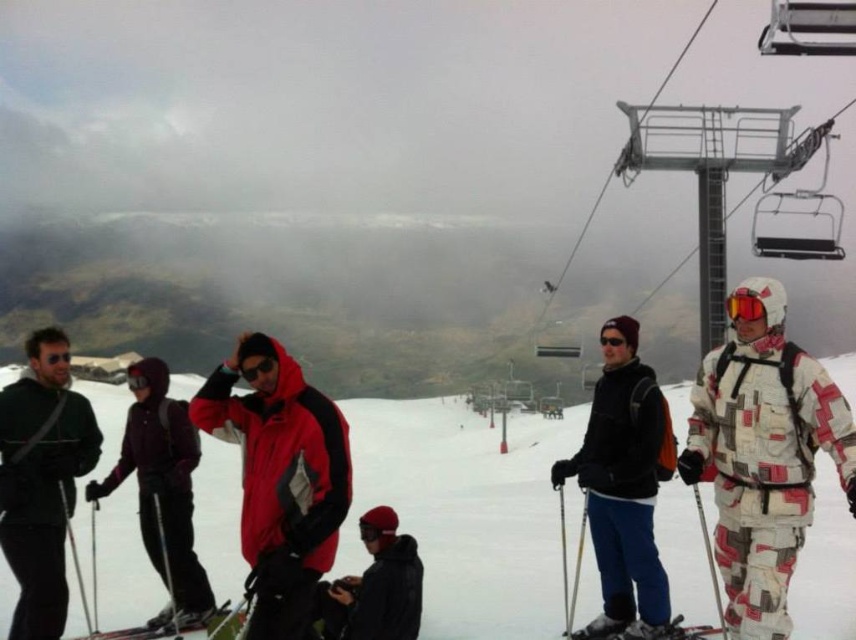
Between metallic gray chair at upper right and matte black ski at lower left, which one has more height?

metallic gray chair at upper right

Does metallic gray chair at upper right have a lesser width compared to matte black ski at lower left?

Incorrect, metallic gray chair at upper right's width is not less than matte black ski at lower left's.

Is point (831, 241) less distant than point (173, 627)?

No, it is not.

What are the coordinates of `metallic gray chair at upper right` in the screenshot? It's located at (797, 225).

Is matte purple ski suit at left bigger than black matte jacket at lower center?

Indeed, matte purple ski suit at left has a larger size compared to black matte jacket at lower center.

Does matte purple ski suit at left come in front of black matte jacket at lower center?

No, matte purple ski suit at left is further to the viewer.

Describe the element at coordinates (162, 490) in the screenshot. I see `matte purple ski suit at left` at that location.

Find the location of a particular element. The height and width of the screenshot is (640, 856). matte purple ski suit at left is located at coordinates (162, 490).

Between metallic gray chair at upper right and metallic gray lift at upper right, which one appears on the left side from the viewer's perspective?

metallic gray lift at upper right

The image size is (856, 640). Describe the element at coordinates (797, 225) in the screenshot. I see `metallic gray chair at upper right` at that location.

Is point (753, 248) more distant than point (774, 19)?

Yes, point (753, 248) is behind point (774, 19).

Where is `metallic gray chair at upper right`? This screenshot has width=856, height=640. metallic gray chair at upper right is located at coordinates (797, 225).